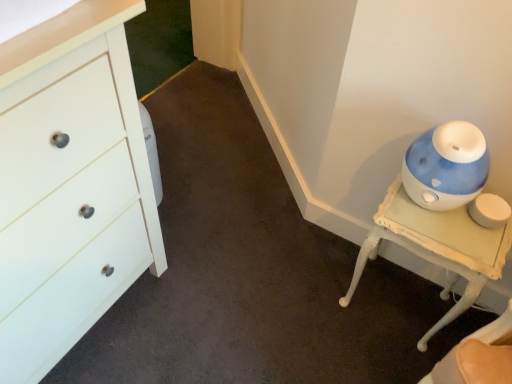
This screenshot has height=384, width=512. Describe the element at coordinates (70, 185) in the screenshot. I see `white matte chest of drawers at left` at that location.

At what (x,y) coordinates should I click in order to perform the action: click on white matte chest of drawers at left. Please return your answer as a coordinate pair (x, y). Image resolution: width=512 pixels, height=384 pixels. Looking at the image, I should click on (70, 185).

What do you see at coordinates (437, 248) in the screenshot? I see `blue glossy humidifier at right` at bounding box center [437, 248].

This screenshot has width=512, height=384. What are the coordinates of `blue glossy humidifier at right` in the screenshot? It's located at (437, 248).

In the scene shown: What is the approximate height of blue glossy humidifier at right?

blue glossy humidifier at right is 19.48 inches tall.

The width and height of the screenshot is (512, 384). What are the coordinates of `white matte chest of drawers at left` in the screenshot? It's located at (70, 185).

Is blue glossy humidifier at right to the right of white matte chest of drawers at left from the viewer's perspective?

Yes.

Is the position of blue glossy humidifier at right more distant than that of white matte chest of drawers at left?

Answer: That is True.

Does point (468, 214) come farther from viewer compared to point (129, 78)?

Yes, point (468, 214) is behind point (129, 78).

From the image's perspective, is blue glossy humidifier at right located beneath white matte chest of drawers at left?

Correct, blue glossy humidifier at right appears lower than white matte chest of drawers at left in the image.

From a real-world perspective, which is physically above, blue glossy humidifier at right or white matte chest of drawers at left?

In real-world perspective, white matte chest of drawers at left is above.

Is blue glossy humidifier at right wider or thinner than white matte chest of drawers at left?

Clearly, blue glossy humidifier at right has less width compared to white matte chest of drawers at left.

Consider the image. Does blue glossy humidifier at right have a greater height compared to white matte chest of drawers at left?

No.

Looking at this image, who is bigger, blue glossy humidifier at right or white matte chest of drawers at left?

white matte chest of drawers at left.

Would you say blue glossy humidifier at right contains white matte chest of drawers at left?

Actually, white matte chest of drawers at left is outside blue glossy humidifier at right.

Is there a large distance between blue glossy humidifier at right and white matte chest of drawers at left?

blue glossy humidifier at right is near white matte chest of drawers at left, not far away.

Is blue glossy humidifier at right positioned with its back to white matte chest of drawers at left?

No, blue glossy humidifier at right is not facing away from white matte chest of drawers at left.

How much distance is there between blue glossy humidifier at right and white matte chest of drawers at left?

blue glossy humidifier at right and white matte chest of drawers at left are 80.02 centimeters apart from each other.

This screenshot has width=512, height=384. In order to click on chest of drawers above the blue glossy humidifier at right (from the image's perspective) in this screenshot , I will do tap(70, 185).

Considering the relative positions of white matte chest of drawers at left and blue glossy humidifier at right in the image provided, is white matte chest of drawers at left to the left or to the right of blue glossy humidifier at right?

Clearly, white matte chest of drawers at left is on the left of blue glossy humidifier at right in the image.

Is the depth of white matte chest of drawers at left less than that of blue glossy humidifier at right?

Yes, it is.

Is point (111, 185) closer to viewer compared to point (454, 230)?

That is True.

From the image's perspective, is white matte chest of drawers at left under blue glossy humidifier at right?

Incorrect, from the image's perspective, white matte chest of drawers at left is higher than blue glossy humidifier at right.

From a real-world perspective, relative to blue glossy humidifier at right, is white matte chest of drawers at left vertically above or below?

white matte chest of drawers at left is above blue glossy humidifier at right.

Between white matte chest of drawers at left and blue glossy humidifier at right, which one has larger width?

white matte chest of drawers at left is wider.

Considering the sizes of white matte chest of drawers at left and blue glossy humidifier at right in the image, is white matte chest of drawers at left taller or shorter than blue glossy humidifier at right?

In the image, white matte chest of drawers at left appears to be taller than blue glossy humidifier at right.

Is white matte chest of drawers at left bigger or smaller than blue glossy humidifier at right?

Clearly, white matte chest of drawers at left is larger in size than blue glossy humidifier at right.

Is blue glossy humidifier at right completely or partially inside white matte chest of drawers at left?

Actually, blue glossy humidifier at right is outside white matte chest of drawers at left.

Are white matte chest of drawers at left and blue glossy humidifier at right beside each other?

No, white matte chest of drawers at left is not with blue glossy humidifier at right.

Is white matte chest of drawers at left facing away from blue glossy humidifier at right?

white matte chest of drawers at left does not have its back to blue glossy humidifier at right.

Locate an element on the screen. The width and height of the screenshot is (512, 384). the chest of drawers that appears above the blue glossy humidifier at right (from the image's perspective) is located at coordinates (70, 185).

The height and width of the screenshot is (384, 512). I want to click on chest of drawers above the blue glossy humidifier at right (from a real-world perspective), so click(70, 185).

Where is `furniture on the right of white matte chest of drawers at left`? The image size is (512, 384). furniture on the right of white matte chest of drawers at left is located at coordinates pyautogui.click(x=437, y=248).